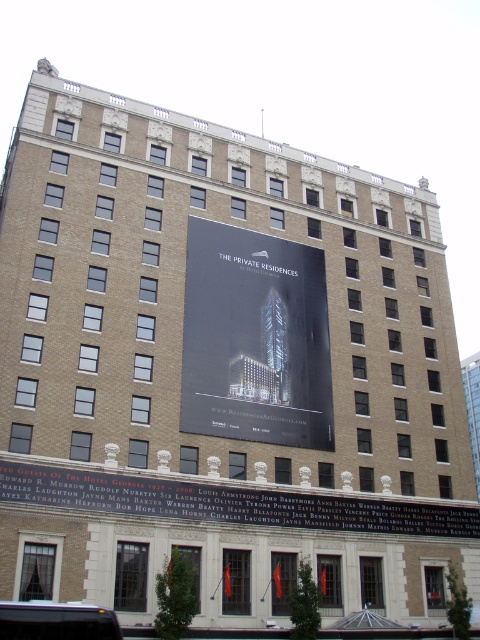
What is located at the coordinates point [254,339] on the building facade?

The black glossy poster at center is located at point [254,339] on the building facade.

You are a painter standing in front of the building and want to paint both the black glossy poster at center and the black glossy sign at center. Which object should you focus on first if you want to paint the wider one first?

The black glossy sign at center is wider than the black glossy poster at center, so you should focus on painting the black glossy sign at center first.

You are a delivery person trying to read the website address on the black glossy poster at center and the black glossy sign at center. Which one is easier to read?

The black glossy sign at center is larger than the black glossy poster at center, so the text on the black glossy sign at center is easier to read.